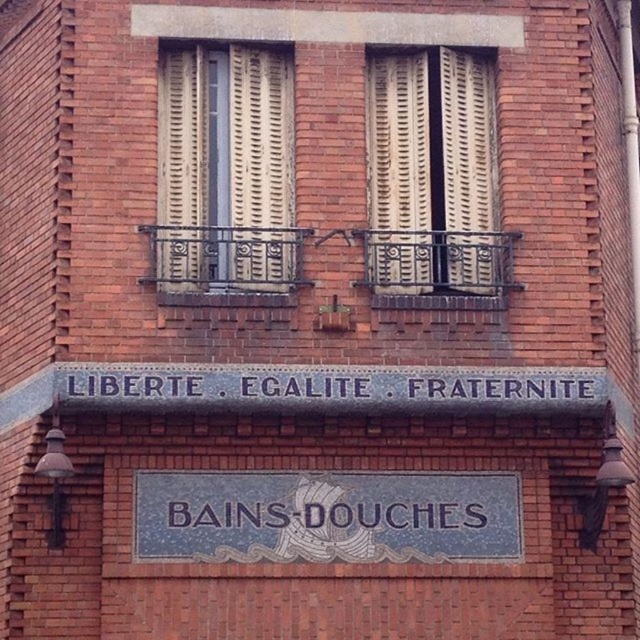
Between blue mosaic sign at center and black wrought iron balcony at center, which one appears on the right side from the viewer's perspective?

blue mosaic sign at center

Who is shorter, blue mosaic sign at center or black wrought iron balcony at center?

blue mosaic sign at center

Who is more forward, (268, 504) or (180, 278)?

Point (268, 504) is more forward.

Locate an element on the screen. blue mosaic sign at center is located at coordinates (326, 516).

Looking at this image, can you confirm if blue mosaic sign at center is taller than gray stone sign at center?

In fact, blue mosaic sign at center may be shorter than gray stone sign at center.

Consider the image. Who is higher up, blue mosaic sign at center or gray stone sign at center?

gray stone sign at center

Describe the element at coordinates (326, 516) in the screenshot. This screenshot has width=640, height=640. I see `blue mosaic sign at center` at that location.

Locate an element on the screen. The width and height of the screenshot is (640, 640). blue mosaic sign at center is located at coordinates (326, 516).

Who is lower down, iron textured balcony at center or black wrought iron balcony at center?

Result: iron textured balcony at center

Between point (486, 291) and point (228, 237), which one is positioned in front?

Point (228, 237) is more forward.

The height and width of the screenshot is (640, 640). What are the coordinates of `iron textured balcony at center` in the screenshot? It's located at (436, 268).

Where is `iron textured balcony at center`? iron textured balcony at center is located at coordinates (436, 268).